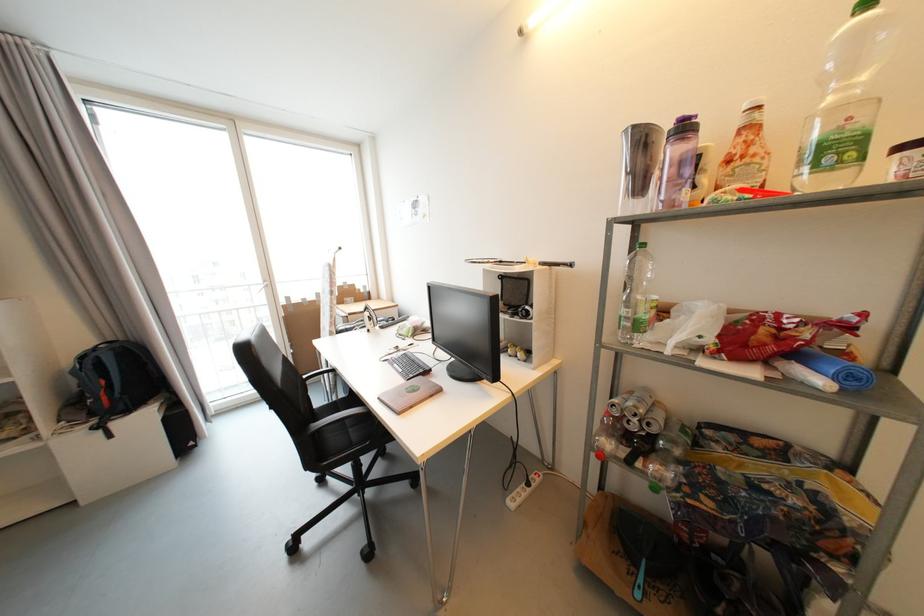
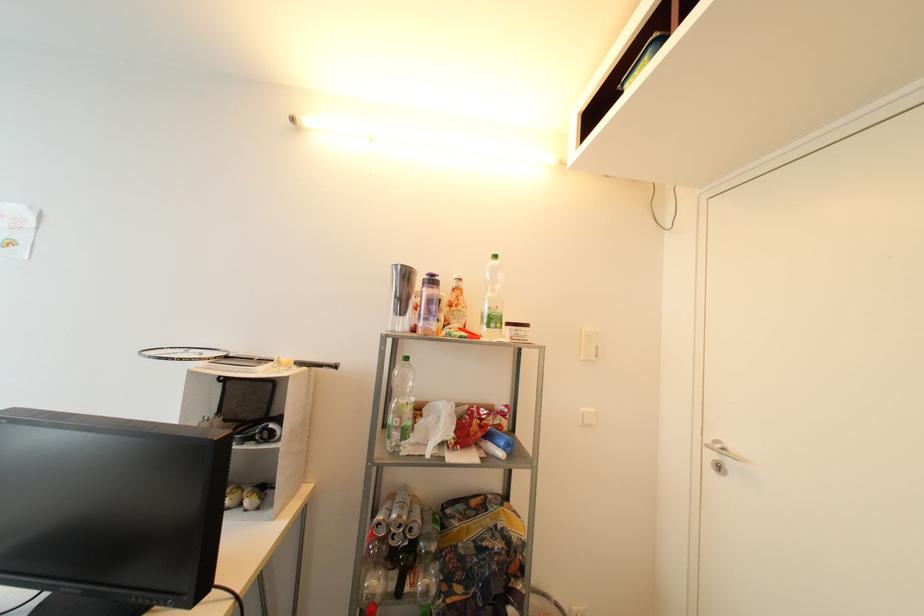
The point at [689,130] is marked in the first image. Where is the corresponding point in the second image?

(438, 283)